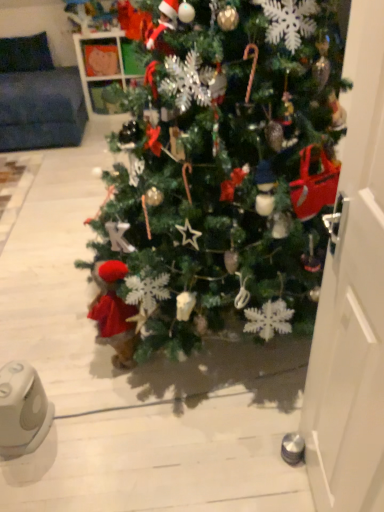
Question: Considering their positions, is white glossy door at right located in front of or behind green matte christmas tree at center?

Choices:
 (A) behind
 (B) front

Answer: (B)

Question: From the image's perspective, is white glossy door at right positioned above or below green matte christmas tree at center?

Choices:
 (A) below
 (B) above

Answer: (A)

Question: Estimate the real-world distances between objects in this image. Which object is farther from the white glossy door at right?

Choices:
 (A) green matte christmas tree at center
 (B) white plastic ipod at lower left

Answer: (B)

Question: Which object is the closest to the white plastic ipod at lower left?

Choices:
 (A) green matte christmas tree at center
 (B) white glossy door at right

Answer: (A)